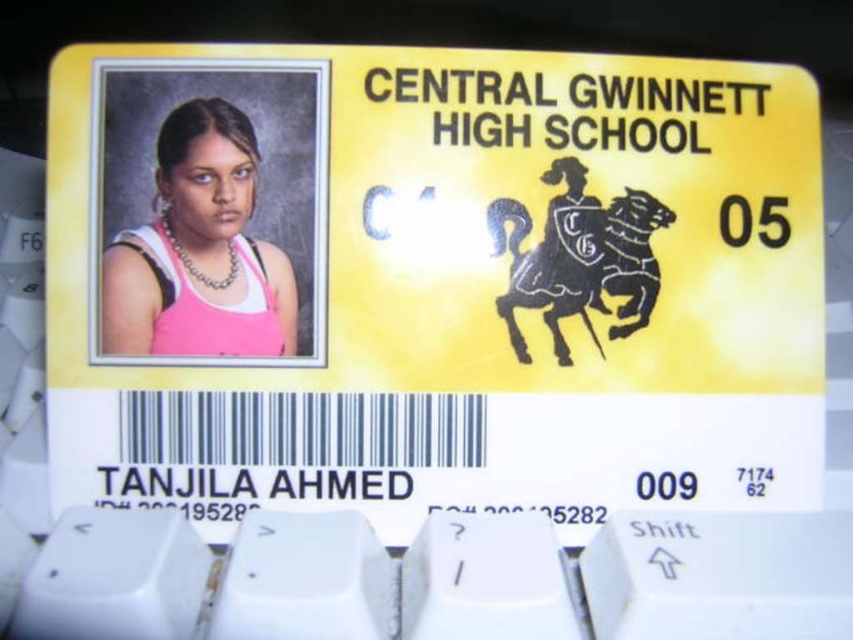
Question: Can you confirm if yellow matte plastic id card at center is positioned to the right of pink fabric at upper left?

Choices:
 (A) no
 (B) yes

Answer: (B)

Question: Which point is closer to the camera?

Choices:
 (A) (228, 179)
 (B) (282, 257)

Answer: (A)

Question: Which point is closer to the camera?

Choices:
 (A) yellow matte plastic id card at center
 (B) pink fabric at upper left

Answer: (A)

Question: Can you confirm if yellow matte plastic id card at center is bigger than pink fabric at upper left?

Choices:
 (A) yes
 (B) no

Answer: (A)

Question: Observing the image, what is the correct spatial positioning of yellow matte plastic id card at center in reference to pink fabric at upper left?

Choices:
 (A) right
 (B) left

Answer: (A)

Question: Which of the following is the closest to the observer?

Choices:
 (A) (480, 392)
 (B) (154, 352)

Answer: (B)